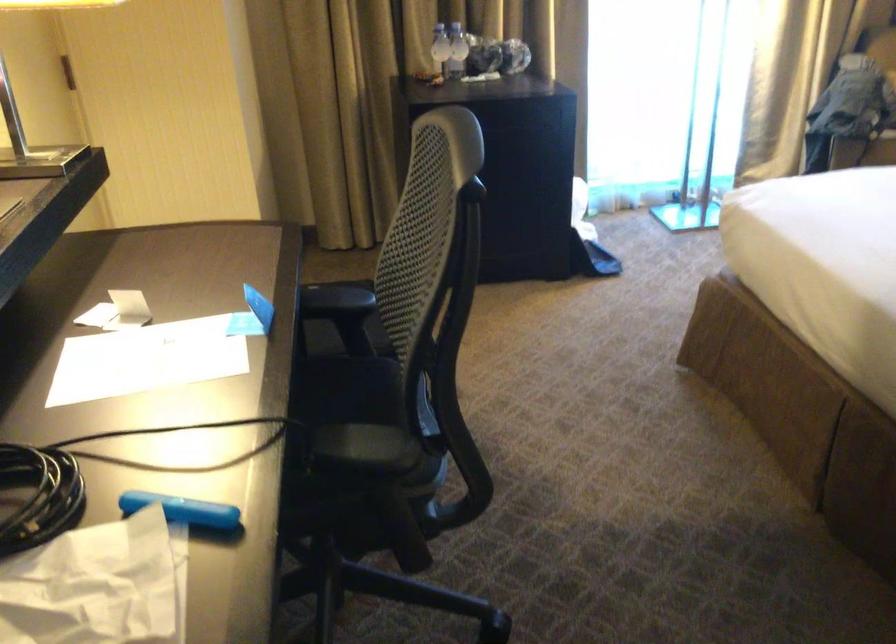
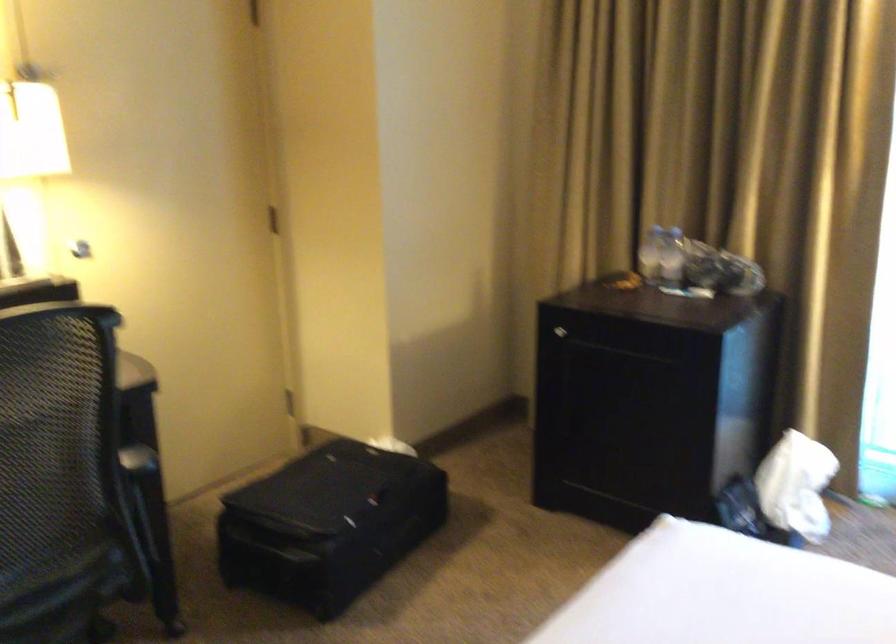
Find the pixel in the second image that matches (x=346, y=374) in the first image.

(136, 527)